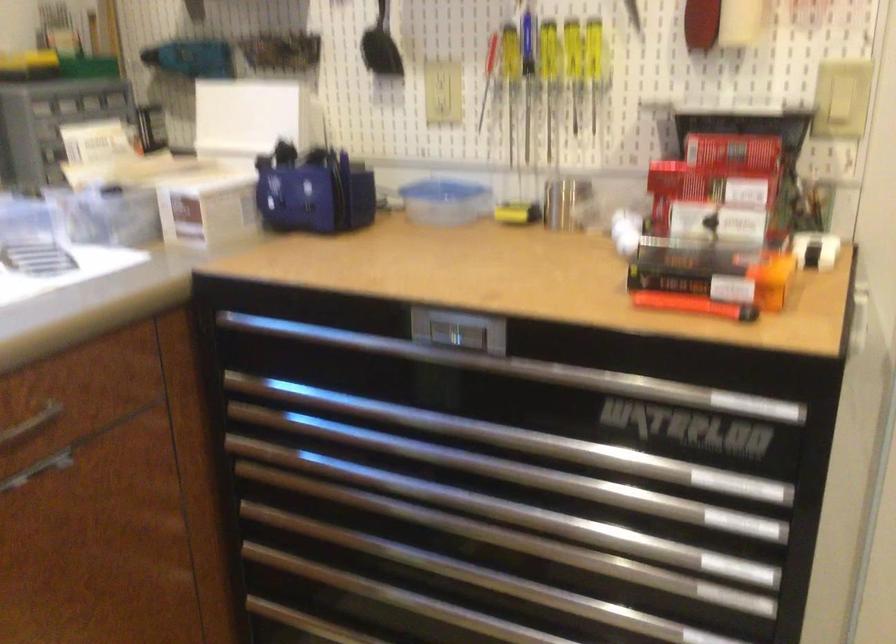
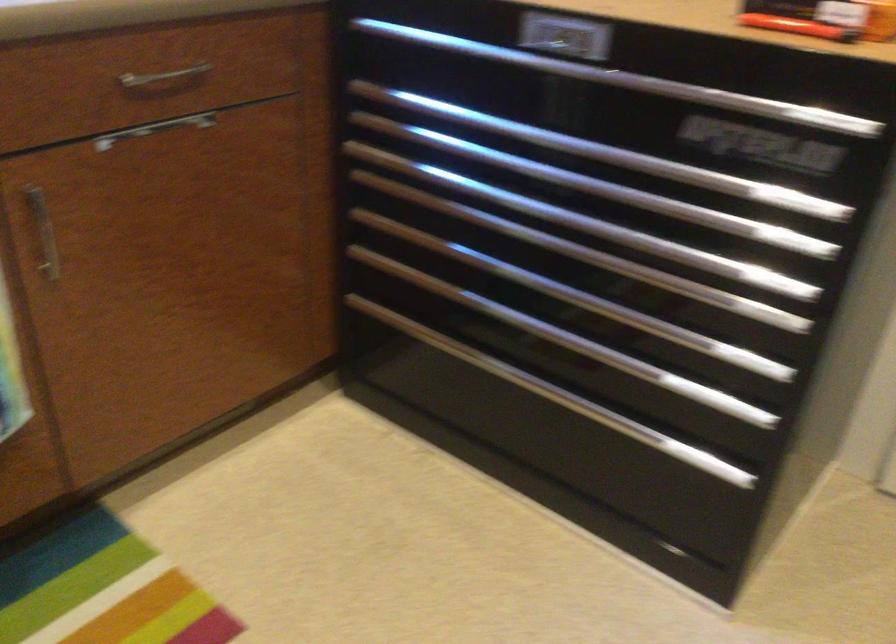
In the second image, find the point that corresponds to (x=461, y=498) in the first image.

(538, 209)